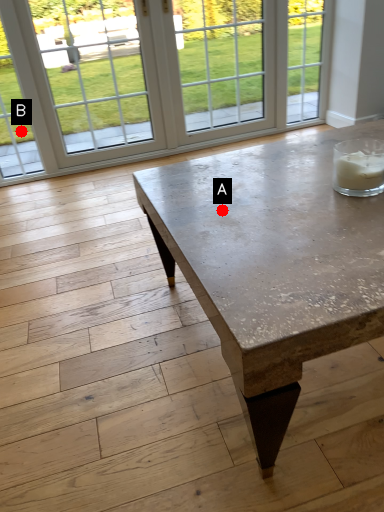
Question: Two points are circled on the image, labeled by A and B beside each circle. Which point is closer to the camera?

Choices:
 (A) A is closer
 (B) B is closer

Answer: (A)